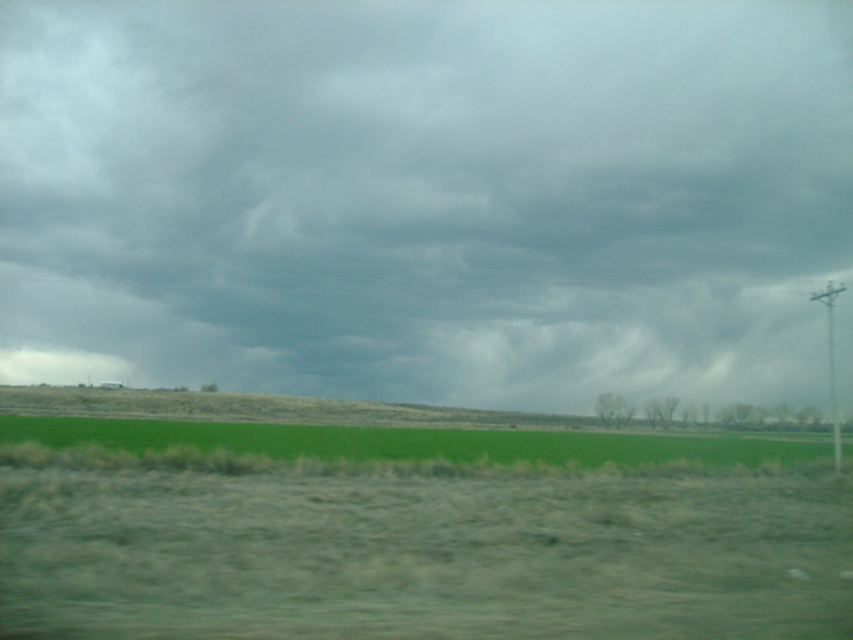
Is dark gray cloud at upper center thinner than green grass at center?

Incorrect, dark gray cloud at upper center's width is not less than green grass at center's.

Who is taller, dark gray cloud at upper center or green grass at center?

dark gray cloud at upper center

In order to click on dark gray cloud at upper center in this screenshot , I will do `click(428, 196)`.

Is point (700, 211) closer to viewer compared to point (265, 436)?

No.

Which is behind, point (223, 381) or point (297, 451)?

The point (223, 381) is more distant.

Is point (432, 252) positioned after point (332, 440)?

Yes, it is behind point (332, 440).

Find the location of a particular element. The width and height of the screenshot is (853, 640). dark gray cloud at upper center is located at coordinates (428, 196).

Is green grass at center below green grass at lower center?

No.

Is green grass at center bigger than green grass at lower center?

No.

Is point (589, 566) behind point (495, 448)?

No, (589, 566) is in front of (495, 448).

The height and width of the screenshot is (640, 853). Identify the location of green grass at center. (415, 532).